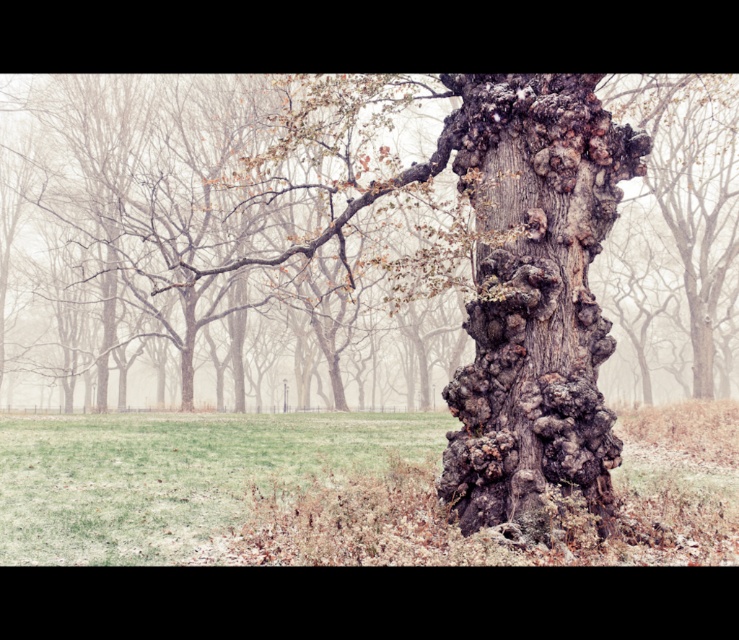
Which of these two, rough bark oak tree at center or dark gray rough bark tree trunk at center, stands shorter?

With less height is dark gray rough bark tree trunk at center.

Can you confirm if rough bark oak tree at center is taller than dark gray rough bark tree trunk at center?

Yes, rough bark oak tree at center is taller than dark gray rough bark tree trunk at center.

This screenshot has width=739, height=640. Find the location of `rough bark oak tree at center`. rough bark oak tree at center is located at coordinates click(531, 298).

Is rough bark tree trunk at center to the right of green grass at center from the viewer's perspective?

Correct, you'll find rough bark tree trunk at center to the right of green grass at center.

Can you confirm if rough bark tree trunk at center is positioned below green grass at center?

Actually, rough bark tree trunk at center is above green grass at center.

You are a GUI agent. You are given a task and a screenshot of the screen. Output one action in this format:
    pyautogui.click(x=<x>, y=<y>)
    Task: Click on the rough bark tree trunk at center
    The image size is (739, 640).
    Given the screenshot: What is the action you would take?
    pyautogui.click(x=364, y=237)

Is green grass at center wider than dark gray rough bark tree trunk at center?

Yes.

The image size is (739, 640). Identify the location of green grass at center. (333, 492).